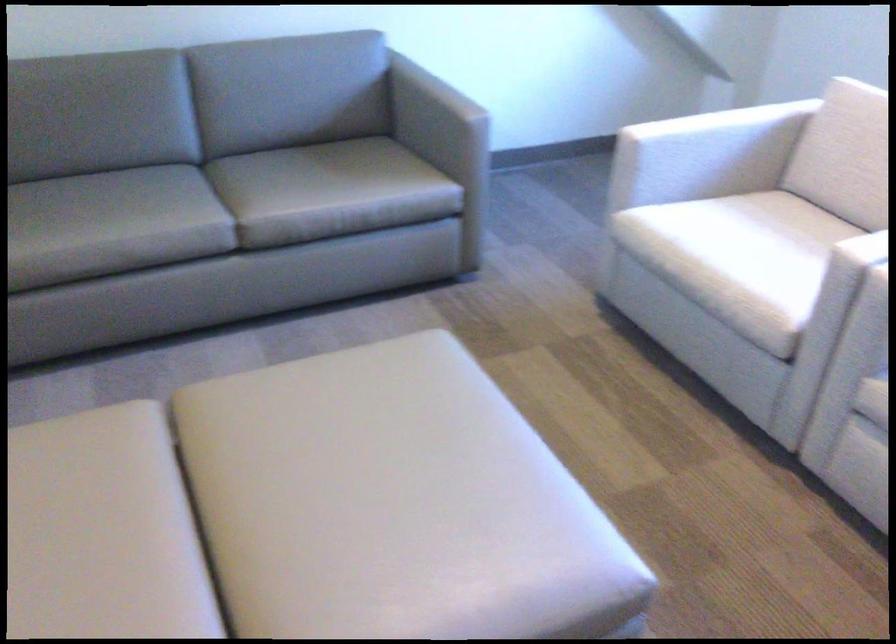
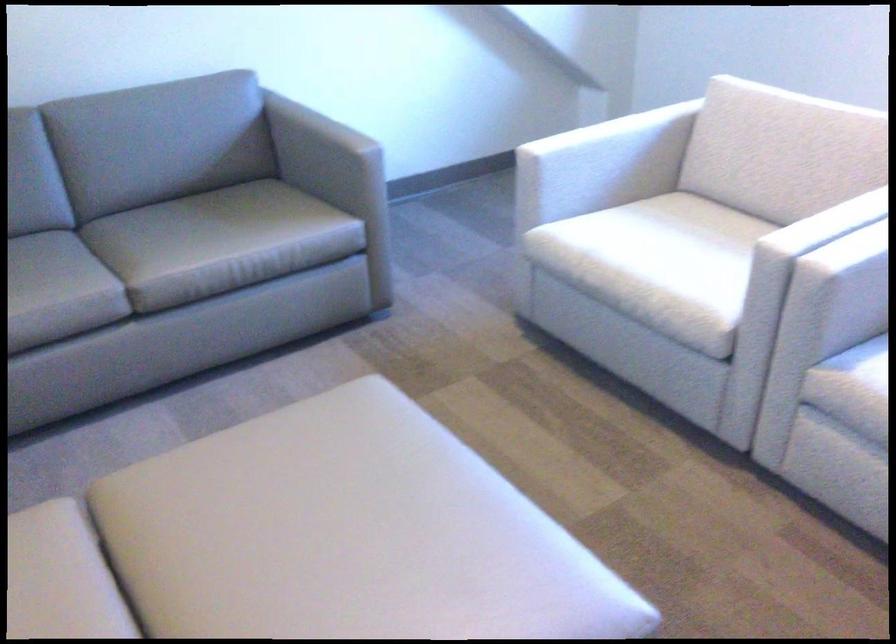
Question: The camera is either moving clockwise (left) or counter-clockwise (right) around the object. The first image is from the beginning of the video and the second image is from the end. Is the camera moving left or right when shooting the video?

Choices:
 (A) Left
 (B) Right

Answer: (A)